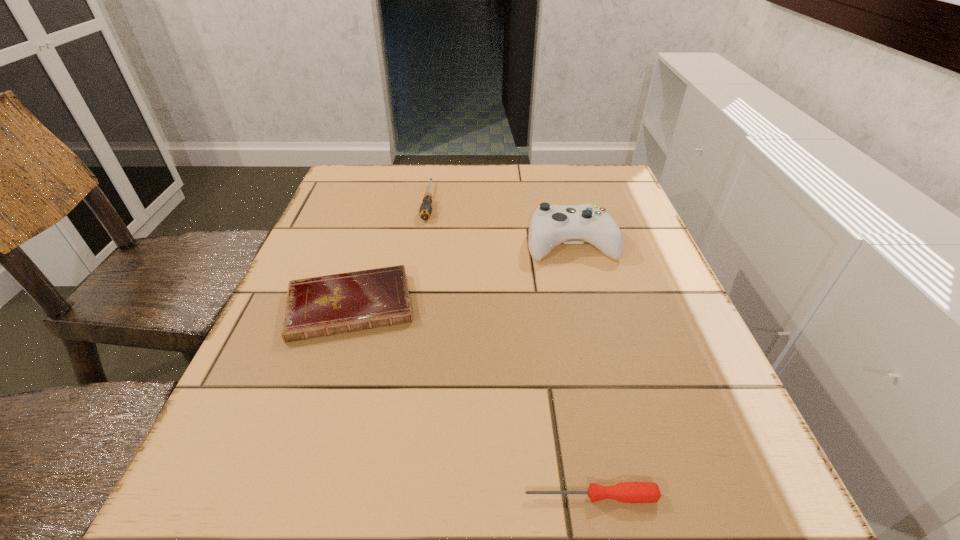
Find the location of a particular element. The width and height of the screenshot is (960, 540). free region located 0.340m at the tip of the nearer screwdriver is located at coordinates (262, 496).

In order to click on vacant space positioned 0.270m at the tip of the nearer screwdriver in this screenshot , I will do `click(317, 496)`.

Where is `vacant space situated at the tip of the nearer screwdriver`? vacant space situated at the tip of the nearer screwdriver is located at coordinates (447, 496).

Find the location of a particular element. The width and height of the screenshot is (960, 540). object that is at the far edge is located at coordinates (425, 210).

Where is `object that is at the near edge`? Image resolution: width=960 pixels, height=540 pixels. object that is at the near edge is located at coordinates (626, 492).

This screenshot has height=540, width=960. What are the coordinates of `object located in the left edge section of the desktop` in the screenshot? It's located at (321, 306).

This screenshot has width=960, height=540. In order to click on control that is positioned at the right edge in this screenshot , I will do `click(550, 225)`.

You are a GUI agent. You are given a task and a screenshot of the screen. Output one action in this format:
    pyautogui.click(x=<x>, y=<y>)
    Task: Click on the screwdriver that is at the right edge
    The image size is (960, 540).
    Given the screenshot: What is the action you would take?
    pyautogui.click(x=626, y=492)

Image resolution: width=960 pixels, height=540 pixels. I want to click on object that is at the near right corner, so click(x=626, y=492).

I want to click on free space at the far edge of the desktop, so click(x=516, y=174).